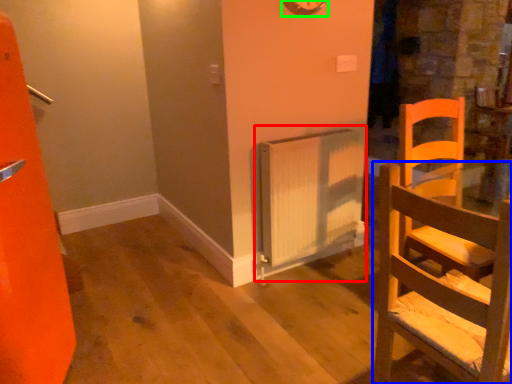
Question: Based on their relative distances, which object is farther from radiator (highlighted by a red box)? Choose from chair (highlighted by a blue box) and clock (highlighted by a green box).

Choices:
 (A) chair
 (B) clock

Answer: (A)